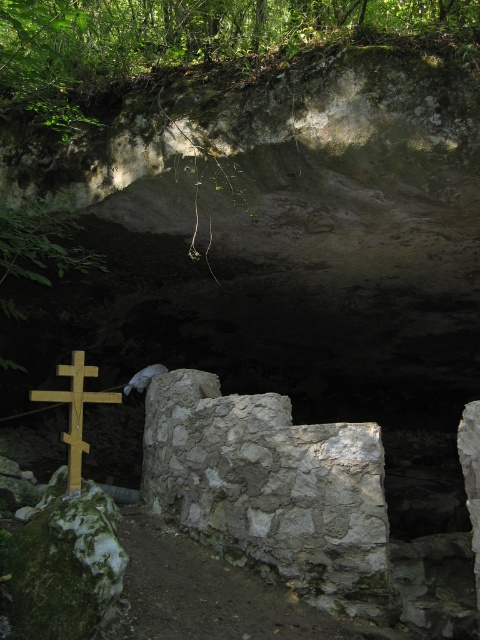
Between gray stone wall at center and wooden cross at left, which one appears on the left side from the viewer's perspective?

wooden cross at left

You are a GUI agent. You are given a task and a screenshot of the screen. Output one action in this format:
    pyautogui.click(x=<x>, y=<y>)
    Task: Click on the gray stone wall at center
    
    Given the screenshot: What is the action you would take?
    pyautogui.click(x=271, y=486)